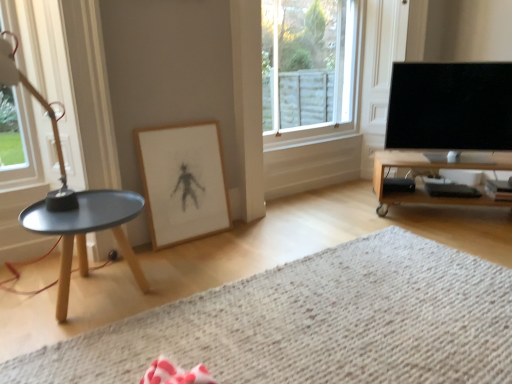
Question: From the image's perspective, is wooden tv stand at right located above or below clear glass window at upper center, which is counted as the first window, starting from the right?

Choices:
 (A) below
 (B) above

Answer: (A)

Question: Is wooden tv stand at right to the left or to the right of clear glass window at upper center, marked as the 2th window in a front-to-back arrangement, in the image?

Choices:
 (A) left
 (B) right

Answer: (B)

Question: Considering the real-world distances, which object is closest to the clear glass window at left, the 2th window when ordered from right to left?

Choices:
 (A) wooden tv stand at right
 (B) white textured rug at lower center
 (C) matte black tray at left
 (D) wooden framed drawing at center
 (E) black glossy tv at right

Answer: (C)

Question: Which is nearer to the black glossy tv at right?

Choices:
 (A) matte black tray at left
 (B) white textured rug at lower center
 (C) wooden tv stand at right
 (D) clear glass window at upper center, positioned as the 2th window in left-to-right order
 (E) clear glass window at left, placed as the second window when sorted from back to front

Answer: (C)